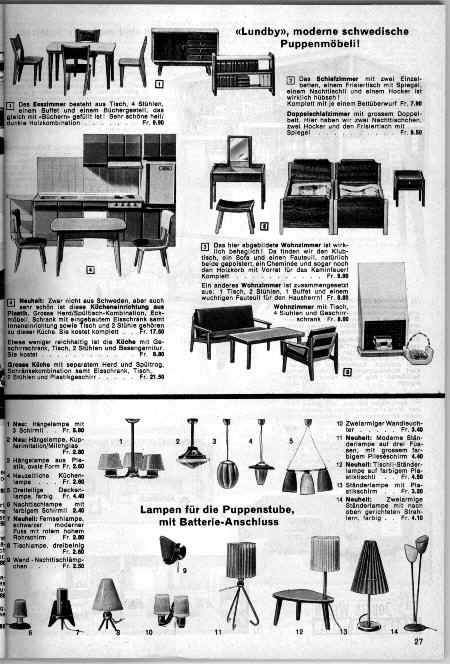
Where is `stove`? The height and width of the screenshot is (664, 450). stove is located at coordinates (122, 197).